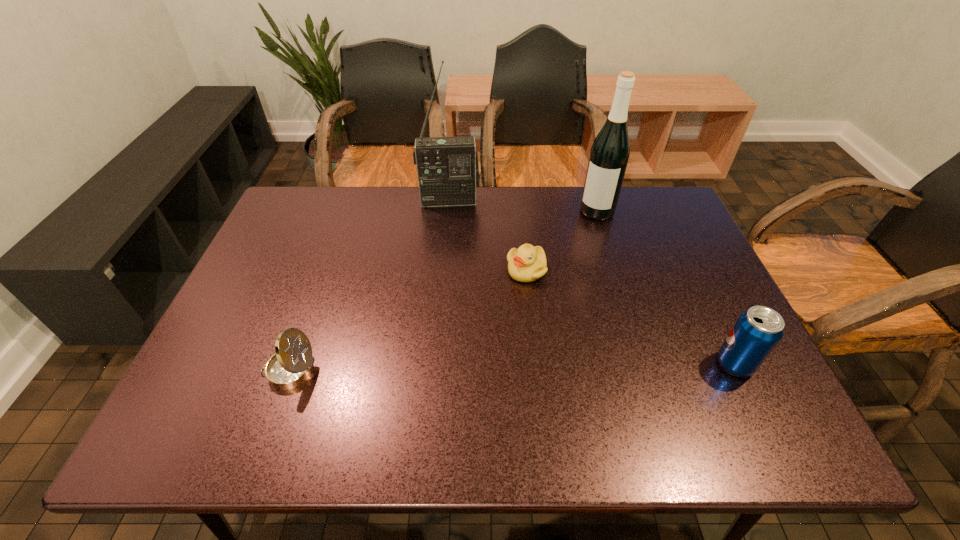
The width and height of the screenshot is (960, 540). I want to click on the fourth tallest object, so click(x=292, y=364).

Where is `the leftmost object`? the leftmost object is located at coordinates (292, 364).

This screenshot has width=960, height=540. What are the coordinates of `pop soda` in the screenshot? It's located at (757, 331).

The width and height of the screenshot is (960, 540). Identify the location of the rightmost object. (757, 331).

Where is `the third object from right to left`? This screenshot has width=960, height=540. the third object from right to left is located at coordinates (527, 263).

Locate an element on the screen. the shortest object is located at coordinates (527, 263).

In order to click on wine bottle in this screenshot , I will do `click(609, 154)`.

Identify the location of radio receiver. (448, 171).

At what (x,y) coordinates should I click in order to perform the action: click on vacant space situated with the dial facing the leftmost object. Please return your answer as a coordinate pair (x, y). The height and width of the screenshot is (540, 960). Looking at the image, I should click on (211, 371).

Find the location of a particular element. Image resolution: width=960 pixels, height=540 pixels. free spot located 0.240m on the left of the rightmost object is located at coordinates (609, 363).